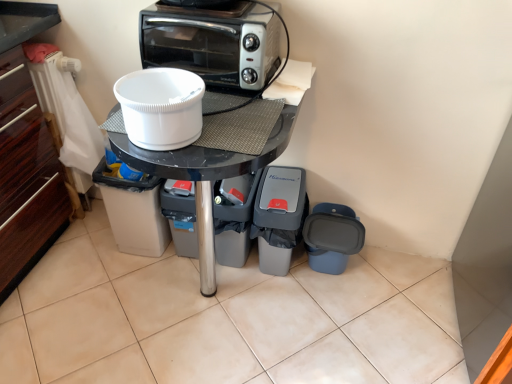
Question: Is white plastic bowl at center, the 2th appliance viewed from the left, smaller than white plastic bucket at center, the first appliance in the left-to-right sequence?

Choices:
 (A) no
 (B) yes

Answer: (B)

Question: From a real-world perspective, is white plastic bowl at center, which is the fourth appliance in right-to-left order, physically below white plastic bucket at center, placed as the fifth appliance when sorted from right to left?

Choices:
 (A) yes
 (B) no

Answer: (B)

Question: Can you confirm if white plastic bowl at center, the 2th appliance viewed from the left, is positioned to the right of white plastic bucket at center, the first appliance in the left-to-right sequence?

Choices:
 (A) yes
 (B) no

Answer: (A)

Question: Is white plastic bowl at center, which is the fourth appliance in right-to-left order, not close to white plastic bucket at center, placed as the fifth appliance when sorted from right to left?

Choices:
 (A) yes
 (B) no

Answer: (B)

Question: Could you tell me if white plastic bowl at center, which is the fourth appliance in right-to-left order, is turned towards white plastic bucket at center, placed as the fifth appliance when sorted from right to left?

Choices:
 (A) no
 (B) yes

Answer: (A)

Question: Considering the relative sizes of white plastic bowl at center, the 2th appliance viewed from the left, and white plastic bucket at center, placed as the fifth appliance when sorted from right to left, in the image provided, is white plastic bowl at center, the 2th appliance viewed from the left, thinner than white plastic bucket at center, placed as the fifth appliance when sorted from right to left,?

Choices:
 (A) no
 (B) yes

Answer: (B)

Question: From a real-world perspective, is gray plastic trash can at lower center, arranged as the second appliance when viewed from the right, on top of silver metallic toaster oven at upper center?

Choices:
 (A) no
 (B) yes

Answer: (A)

Question: Does gray plastic trash can at lower center, arranged as the second appliance when viewed from the right, have a lesser width compared to silver metallic toaster oven at upper center?

Choices:
 (A) yes
 (B) no

Answer: (B)

Question: Is gray plastic trash can at lower center, arranged as the second appliance when viewed from the right, at the left side of silver metallic toaster oven at upper center?

Choices:
 (A) yes
 (B) no

Answer: (B)

Question: Would you say gray plastic trash can at lower center, arranged as the second appliance when viewed from the right, contains silver metallic toaster oven at upper center?

Choices:
 (A) no
 (B) yes

Answer: (A)

Question: Is gray plastic trash can at lower center, arranged as the second appliance when viewed from the right, located outside silver metallic toaster oven at upper center?

Choices:
 (A) yes
 (B) no

Answer: (A)

Question: Is white plastic bucket at center, placed as the fifth appliance when sorted from right to left, positioned in front of blue plastic trash can at lower right, the fifth appliance when ordered from left to right?

Choices:
 (A) no
 (B) yes

Answer: (B)